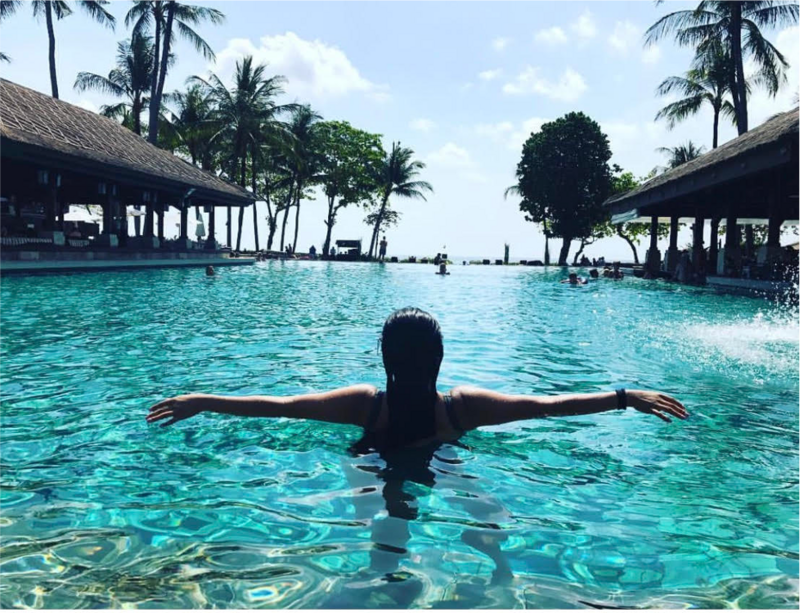
Identify the location of bar. [32, 230], [764, 257].